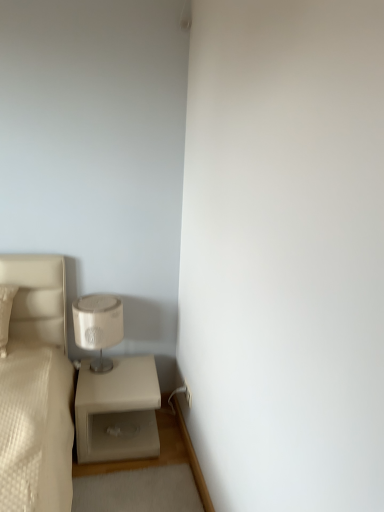
Identify the location of free area below matte beige lampshade at lower left (from a real-world perspective). The height and width of the screenshot is (512, 384). (102, 374).